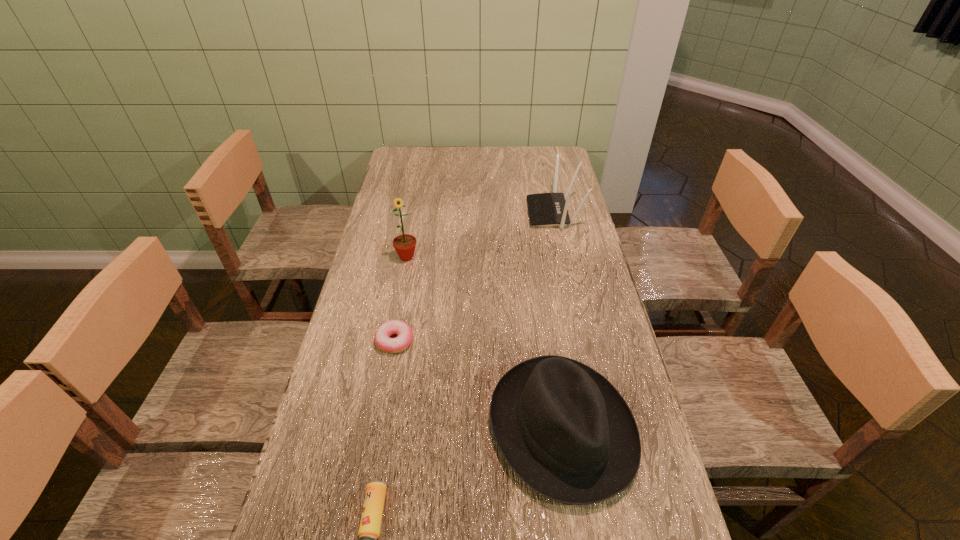
Locate an element on the screen. The width and height of the screenshot is (960, 540). free space that is in between the tallest object and the fedora is located at coordinates (484, 342).

Find the location of a particular element. The image size is (960, 540). empty space that is in between the third farthest object and the third tallest object is located at coordinates (478, 384).

Identify the location of vacant area that lies between the tallest object and the third nearest object. The height and width of the screenshot is (540, 960). (400, 299).

Identify the location of empty space between the third tallest object and the doughnut. The height and width of the screenshot is (540, 960). (478, 384).

Identify the location of vacant space that's between the fedora and the farthest object. Image resolution: width=960 pixels, height=540 pixels. (558, 320).

At what (x,y) coordinates should I click in order to perform the action: click on object that is the second closest to the router. Please return your answer as a coordinate pair (x, y). The height and width of the screenshot is (540, 960). Looking at the image, I should click on (564, 429).

Locate which object ranks third in proximity to the beer can. Please provide its 2D coordinates. Your answer should be formatted as a tuple, i.e. [(x, y)], where the tuple contains the x and y coordinates of a point satisfying the conditions above.

[(404, 244)]

Identify the location of free space that satisfies the following two spatial constraints: 1. on the face of the doughnut; 2. on the left side of the tallest object. The height and width of the screenshot is (540, 960). (391, 340).